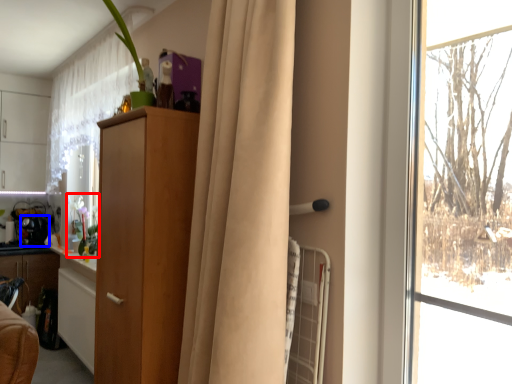
Question: Which of the following is the farthest to the observer, floral arrangement (highlighted by a red box) or appliance (highlighted by a blue box)?

Choices:
 (A) floral arrangement
 (B) appliance

Answer: (B)